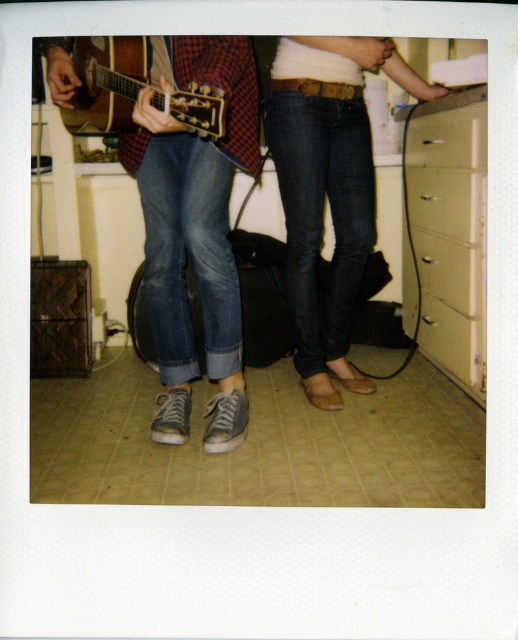
Between denim jeans at center and matte white drawer at center right, which one has more height?

denim jeans at center is taller.

Can you confirm if denim jeans at center is positioned above matte white drawer at center right?

Correct, denim jeans at center is located above matte white drawer at center right.

Does point (65, 99) lie behind point (433, 276)?

No, (65, 99) is in front of (433, 276).

Find the location of a particular element. This screenshot has width=518, height=640. denim jeans at center is located at coordinates (189, 214).

Between beige plastic file cabinet at right and matte white drawer at right, which one appears on the left side from the viewer's perspective?

matte white drawer at right

Which is behind, point (427, 179) or point (477, 109)?

Positioned behind is point (427, 179).

Which is behind, point (482, 88) or point (427, 132)?

Point (427, 132)

Image resolution: width=518 pixels, height=640 pixels. Find the location of `beige plastic file cabinet at right`. beige plastic file cabinet at right is located at coordinates (451, 230).

Is beige plastic file cabinet at right taller than matte brown acoustic guitar at left?

Correct, beige plastic file cabinet at right is much taller as matte brown acoustic guitar at left.

Does beige plastic file cabinet at right have a smaller size compared to matte brown acoustic guitar at left?

No.

Which is behind, point (467, 291) or point (136, 36)?

Positioned behind is point (467, 291).

At what (x,y) coordinates should I click in order to perform the action: click on beige plastic file cabinet at right. Please return your answer as a coordinate pair (x, y). Image resolution: width=518 pixels, height=640 pixels. Looking at the image, I should click on (451, 230).